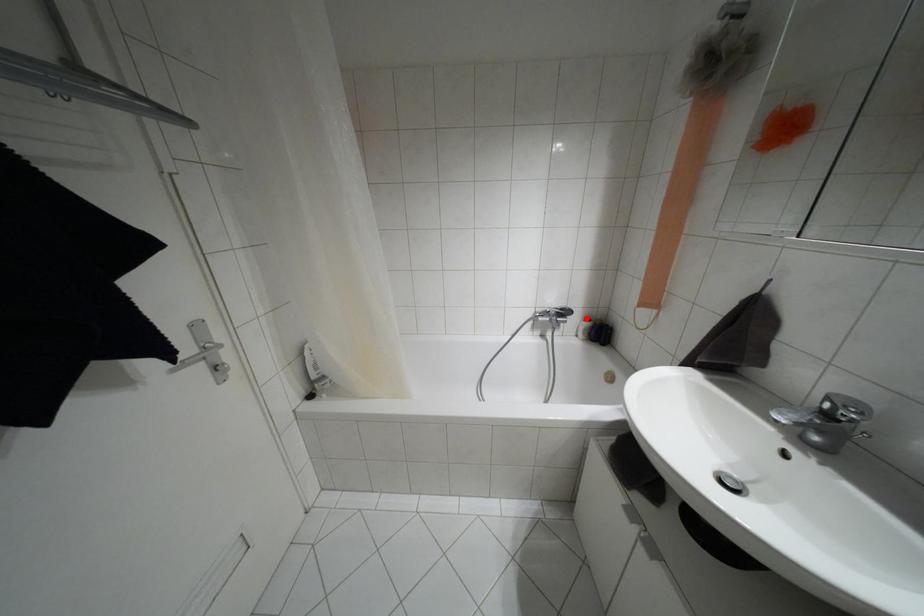
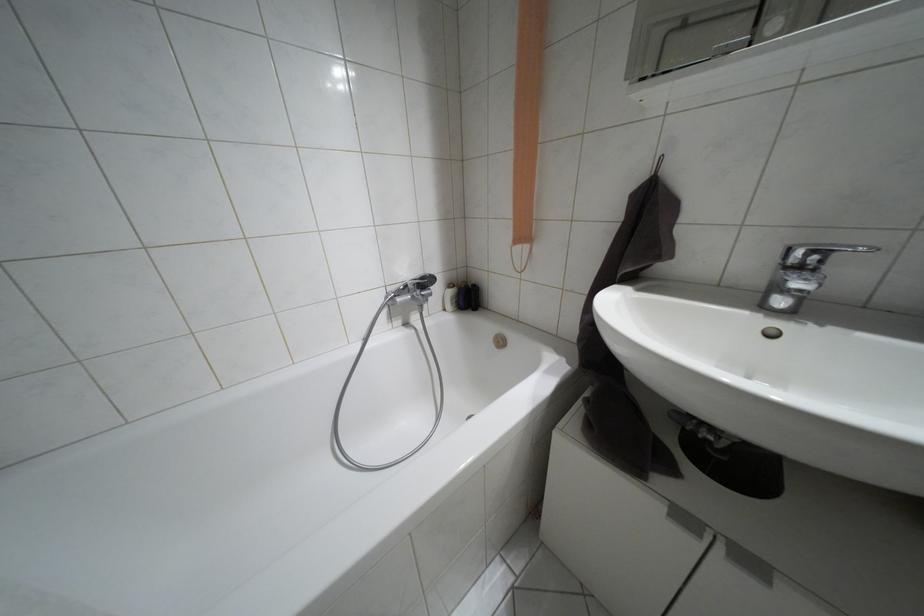
Locate, in the second image, the point that corresponds to the highlighted location in the first image.

(448, 285)